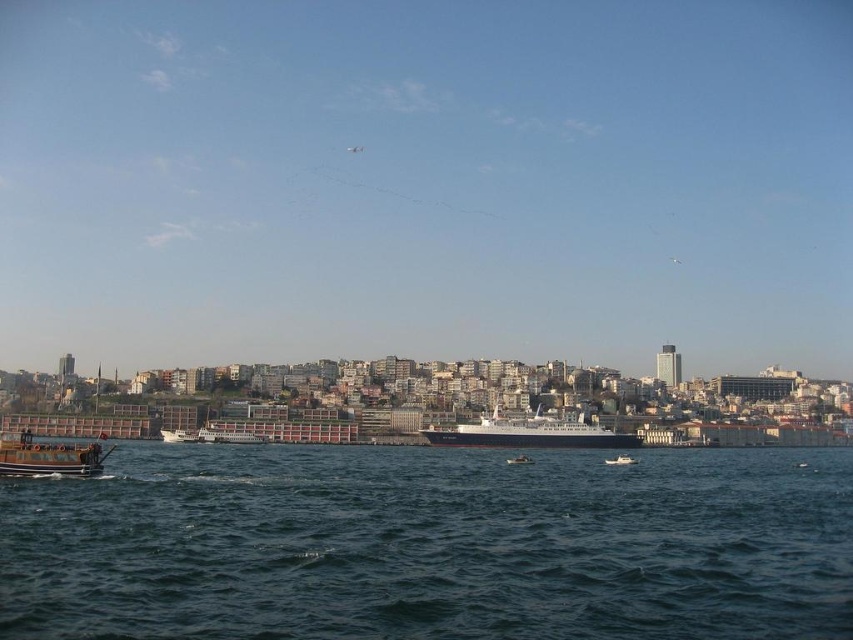
You are a photographer planning to capture both the white glossy ship at center and the wooden boat at lower left in a single shot. Given that your camera has a limited field of view, which object should you position closer to the center of the frame to ensure both are fully visible?

You should position the wooden boat at lower left closer to the center of the frame because the white glossy ship at center is wider, so centering the smaller wooden boat at lower left would allow both to fit within the camera frame.

You are standing at the waterfront and want to visit the point marked as point (x=436, y=429). Given that you can walk 100 meters per minute, how long will it take you to reach that point?

The distance between you and point (x=436, y=429) is 154.93 meters. At a walking speed of 100 meters per minute, it would take approximately 1.55 minutes to reach the point.

You are a photographer planning to capture the waterfront scene. You want to ensure both the white glossy ship at center and the wooden boat at lower left are clearly visible in your shot. Given their sizes, which object might require you to adjust your camera angle to fit both into the frame?

The white glossy ship at center occupies less space than the wooden boat at lower left, so the wooden boat at lower left is larger and might require adjusting the camera angle to ensure both fit into the frame.